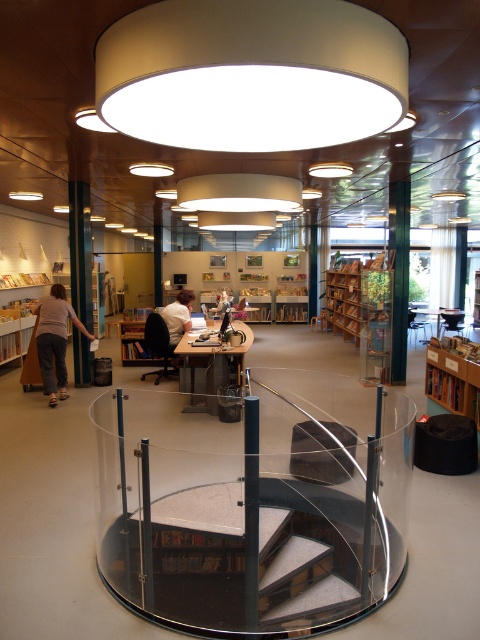
Does point (354, 300) lie behind point (467, 396)?

Yes, point (354, 300) is farther from viewer.

Is wooden bookshelf at center behind wooden bookshelf at lower right?

Yes, it is behind wooden bookshelf at lower right.

Find the location of a particular element. wooden bookshelf at center is located at coordinates (359, 292).

I want to click on wooden bookshelf at center, so click(x=359, y=292).

Which of these two, wooden bookshelf at center or white shirt at center, stands shorter?

With less height is wooden bookshelf at center.

Does wooden bookshelf at center lie in front of white shirt at center?

That is False.

Who is more forward, (x=385, y=317) or (x=167, y=314)?

Point (x=385, y=317)

Find the location of a particular element. wooden bookshelf at center is located at coordinates (359, 292).

Which is below, matte gray pants at lower left or white shirt at center?

Positioned lower is matte gray pants at lower left.

Is point (44, 314) closer to viewer compared to point (192, 296)?

Yes, it is.

Find the location of `matte gray pants at lower left`. matte gray pants at lower left is located at coordinates (55, 339).